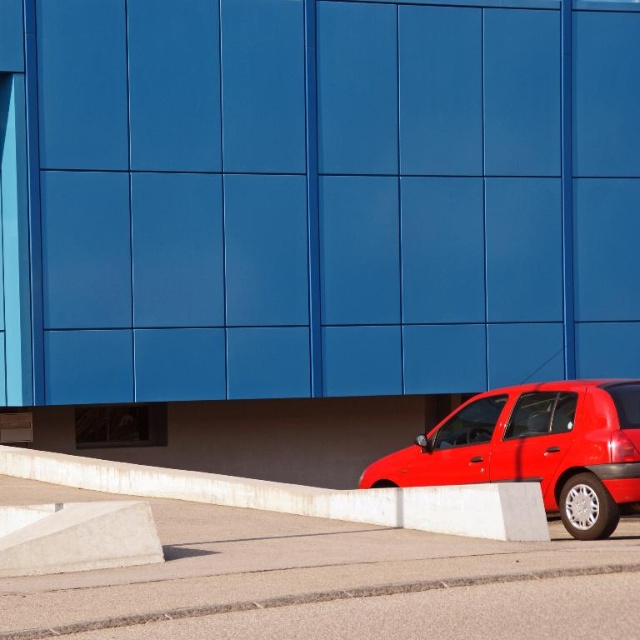
Looking at this image, you are a delivery driver who needs to park your vehicle in the parking lot. You see the glossy red car at lower right and the white concrete curb at lower right. Which object is closer to the curb?

The glossy red car at lower right is positioned on the right side of the white concrete curb at lower right, meaning it is closer to the curb than the curb itself. However, since the curb is an object, the car is adjacent to it but not closer than the curb. The question might be better phrased to ask which is closer to the parking lot entrance or another reference point.

You are a parking attendant and need to guide a driver to park their car exactly at the center of the parking spot marked at coordinates point 0.5, 0.5. Currently, the glossy red car at lower right is parked at point 0.702, 0.838. Can you determine if the car is properly aligned with the center of the parking spot?

The glossy red car at lower right is located at point (536, 449), which is not the center of the parking spot marked at (320, 320). Therefore, the car is not properly aligned with the center.

Consider the image. You are a delivery driver who needs to park your vehicle in a space that requires clearance under the car to avoid hitting obstacles. Based on the image, which object between the glossy red car at lower right and the white concrete curb at lower right has a lower height, indicating better clearance?

The glossy red car at lower right has a lesser height compared to the white concrete curb at lower right, so it provides better clearance for parking.